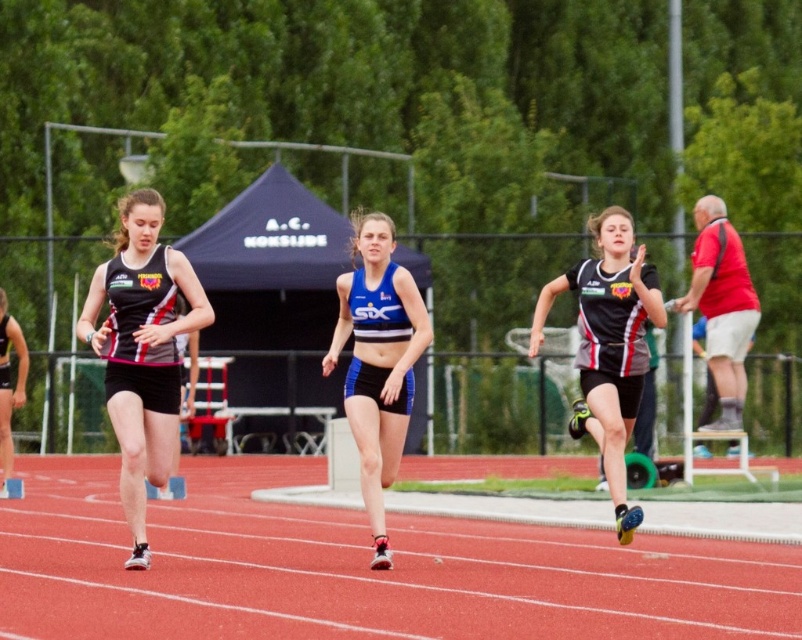
You are a photographer positioned at the finish line of the track and field event. You want to capture a photo that includes both the red rubber track at center and the black matte running uniform at left. Considering their sizes, which object should you zoom in on to ensure both fit in the frame without cropping?

The red rubber track at center is wider than the black matte running uniform at left, so you should zoom in on the red rubber track at center to ensure both objects fit in the frame.

You are a photographer trying to capture the sprint race. You notice the red rubber track at center and the black matte running uniform at left. Which object would appear bigger in your photo?

The red rubber track at center would appear bigger in the photo since it has a larger size compared to the black matte running uniform at left.

You are a coach observing the sprint race. You need to determine if the distance between the black matte running uniform at left and the blue matte shorts at center is sufficient for a safe overtaking maneuver. The minimum safe distance required for overtaking is 6 feet. Is the current distance enough?

The distance between the black matte running uniform at left and the blue matte shorts at center is 5.90 feet, which is slightly less than the required 6 feet. Therefore, the current distance is not sufficient for a safe overtaking maneuver.